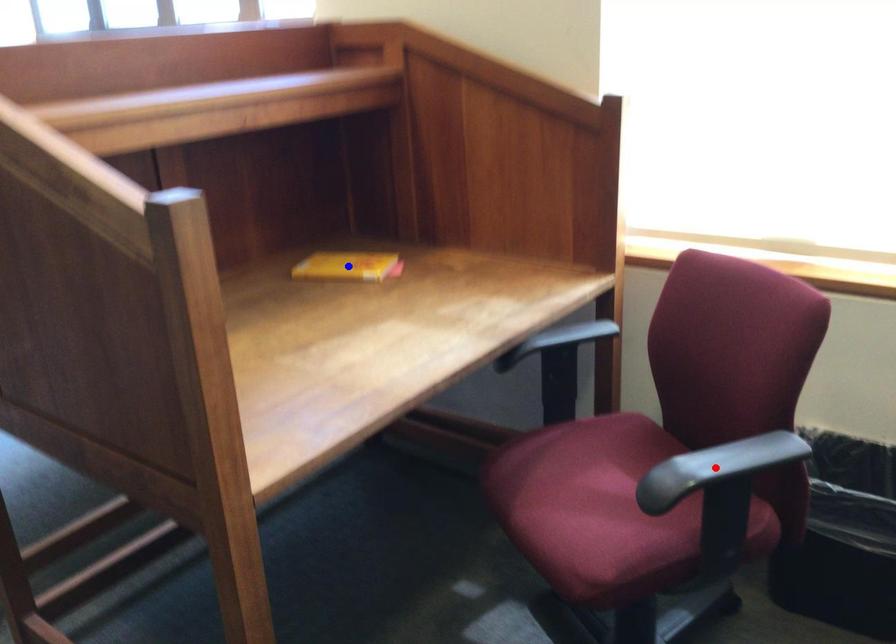
Question: Which of the two points in the image is closer to the camera?

Choices:
 (A) Blue point is closer.
 (B) Red point is closer.

Answer: (B)